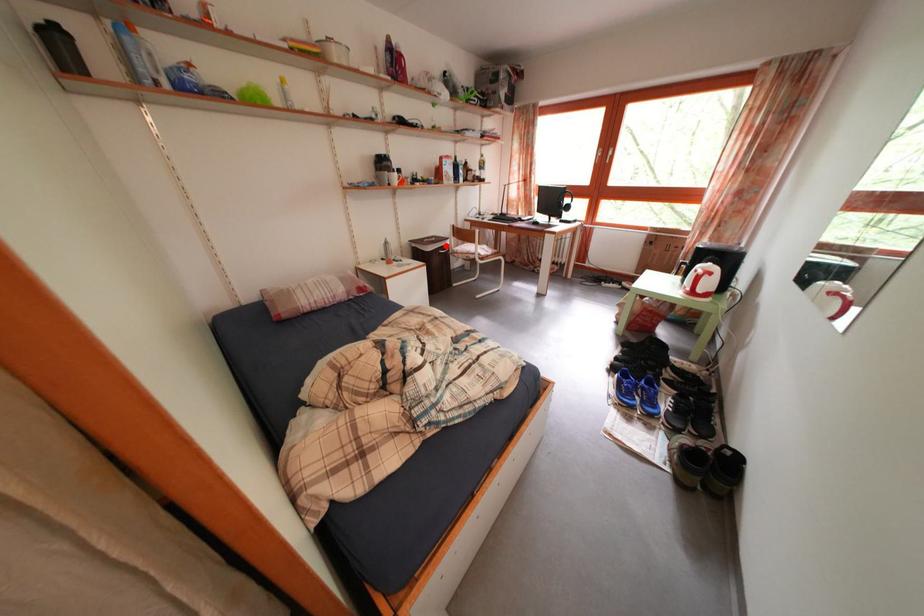
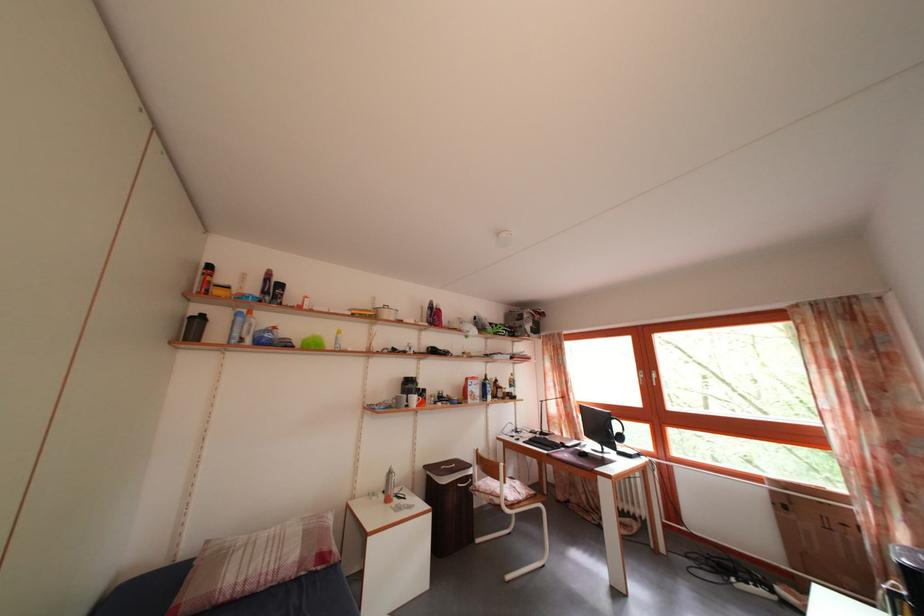
Question: I am providing you with two images of the same scene from different viewpoints. Given a red point in image1, look at the same physical point in image2. Is it:

Choices:
 (A) Closer to the viewpoint
 (B) Farther from the viewpoint

Answer: (B)